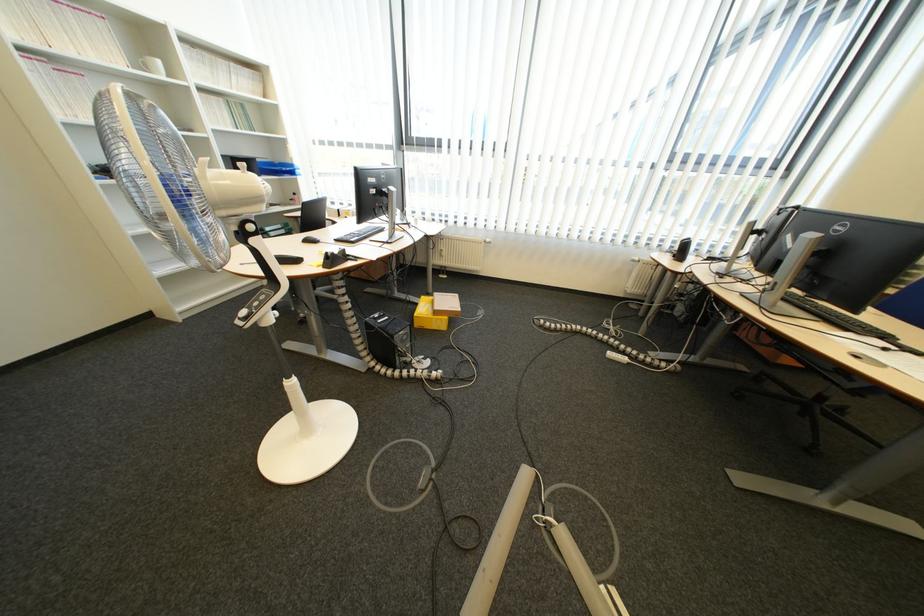
The height and width of the screenshot is (616, 924). Describe the element at coordinates (292, 390) in the screenshot. I see `the black office chair` at that location.